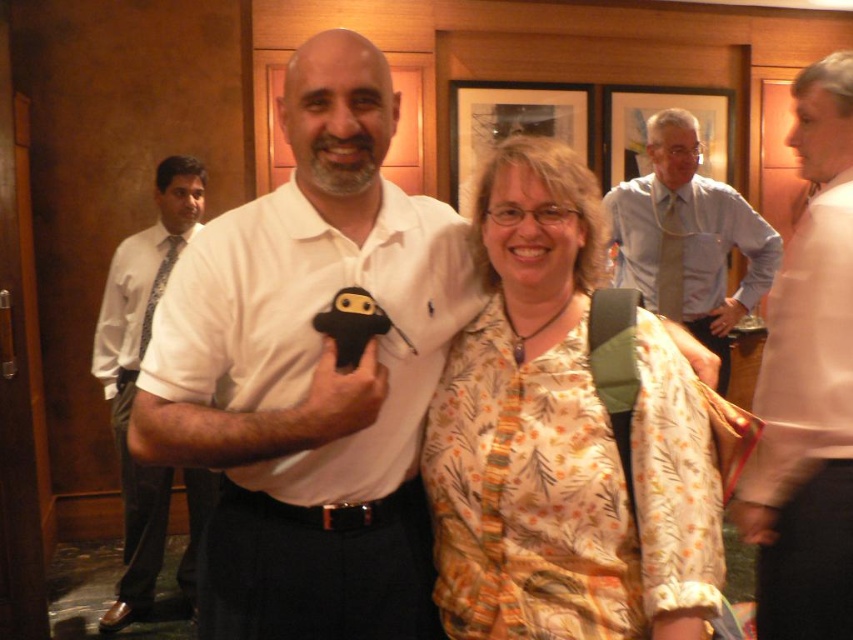
Question: Can you confirm if white matte shirt at center is positioned to the right of floral print blouse at center?

Choices:
 (A) no
 (B) yes

Answer: (A)

Question: Which point appears closest to the camera in this image?

Choices:
 (A) (703, 628)
 (B) (722, 365)

Answer: (A)

Question: Which object appears closest to the camera in this image?

Choices:
 (A) light blue shirt at upper right
 (B) floral print blouse at center

Answer: (B)

Question: Which point is closer to the camera taking this photo?

Choices:
 (A) (184, 477)
 (B) (701, 500)

Answer: (B)

Question: Observing the image, what is the correct spatial positioning of pink fabric shirt at right in reference to light blue shirt at upper right?

Choices:
 (A) above
 (B) below

Answer: (B)

Question: Does floral print blouse at center have a smaller size compared to white shirt at left?

Choices:
 (A) yes
 (B) no

Answer: (A)